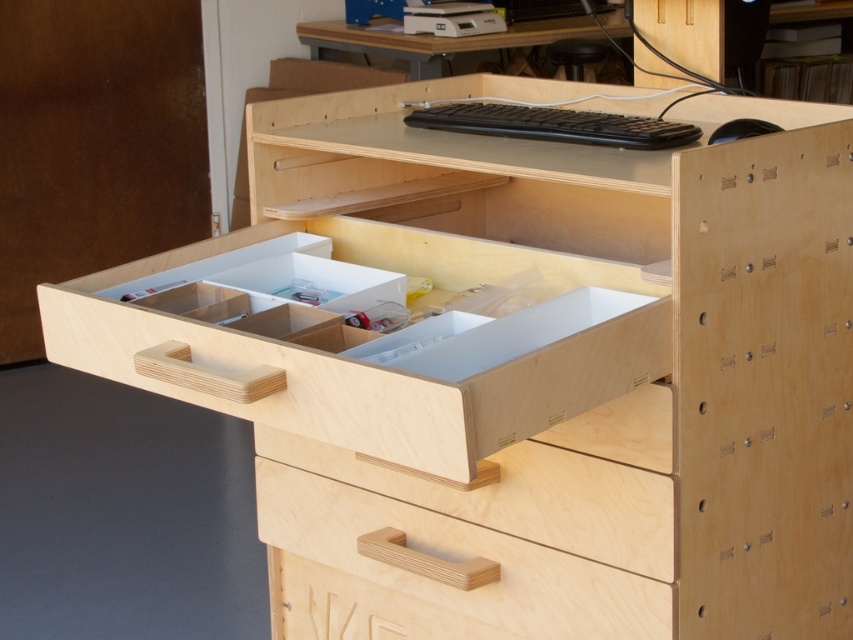
Question: Is matte wood table at upper center to the left of black plastic mouse at upper right from the viewer's perspective?

Choices:
 (A) no
 (B) yes

Answer: (B)

Question: Does black matte keyboard at upper center appear on the right side of black plastic mouse at upper right?

Choices:
 (A) no
 (B) yes

Answer: (A)

Question: Which is farther from the black matte keyboard at upper center?

Choices:
 (A) black plastic mouse at upper right
 (B) matte wood table at upper center
 (C) plywood drawer at center

Answer: (B)

Question: Which of the following is the closest to the observer?

Choices:
 (A) (751, 129)
 (B) (543, 129)
 (C) (262, 380)
 (D) (381, 28)

Answer: (C)

Question: Which point is closer to the camera?

Choices:
 (A) click(584, 20)
 (B) click(721, 141)

Answer: (B)

Question: Does matte wood table at upper center have a larger size compared to black plastic mouse at upper right?

Choices:
 (A) yes
 (B) no

Answer: (A)